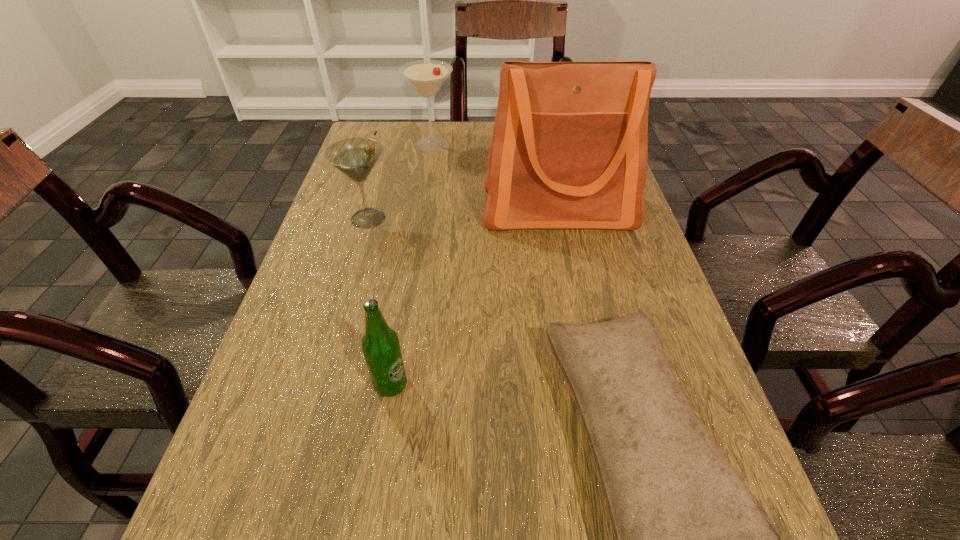
Where is `object that is at the far left corner`? object that is at the far left corner is located at coordinates (426, 76).

The height and width of the screenshot is (540, 960). Identify the location of free spot at the far edge of the desktop. (469, 126).

In the image, there is a desktop. Identify the location of vacant area at the left edge. (356, 227).

Where is `vacant space at the far left corner`? The width and height of the screenshot is (960, 540). vacant space at the far left corner is located at coordinates (405, 126).

Locate an element on the screen. Image resolution: width=960 pixels, height=540 pixels. free area in between the farthest object and the beer bottle is located at coordinates (x=412, y=265).

Where is `free area in between the nearer martini and the farthest object`? The width and height of the screenshot is (960, 540). free area in between the nearer martini and the farthest object is located at coordinates (400, 181).

Where is `vacant space in between the farther martini and the nearer martini`? vacant space in between the farther martini and the nearer martini is located at coordinates (400, 181).

Where is `vacant space that is in between the beer bottle and the tallest object`? vacant space that is in between the beer bottle and the tallest object is located at coordinates (474, 298).

Identify the location of vacant area between the nearer martini and the beer bottle. Image resolution: width=960 pixels, height=540 pixels. (379, 301).

In order to click on object that stands as the fourth closest to the tallest object in this screenshot , I will do [380, 344].